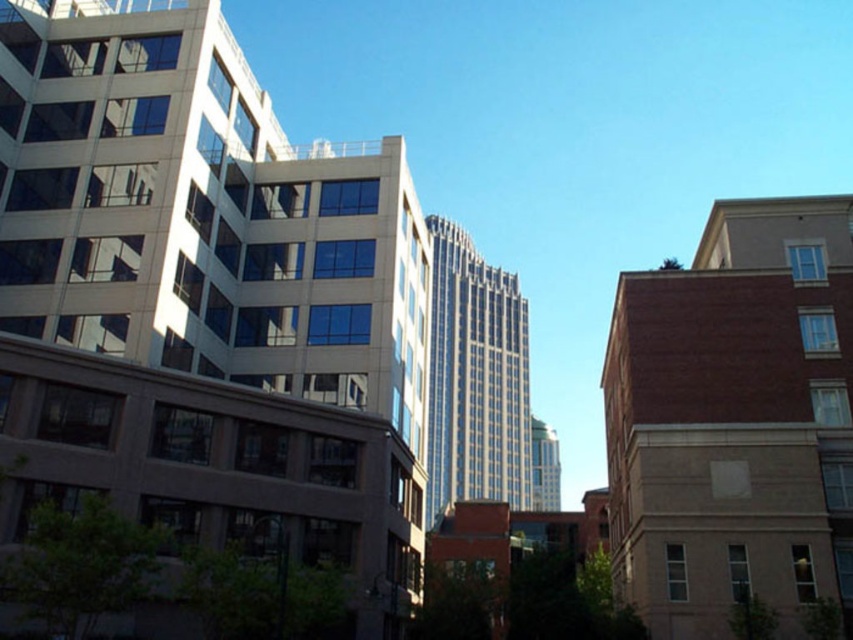
Is matte glass building at center thinner than glassy silver skyscraper at center?

Indeed, matte glass building at center has a lesser width compared to glassy silver skyscraper at center.

Consider the image. Can you confirm if matte glass building at center is positioned to the right of glassy silver skyscraper at center?

In fact, matte glass building at center is to the left of glassy silver skyscraper at center.

Looking at this image, measure the distance between point [44,58] and camera.

43.92 meters

Identify the location of matte glass building at center. point(212,288).